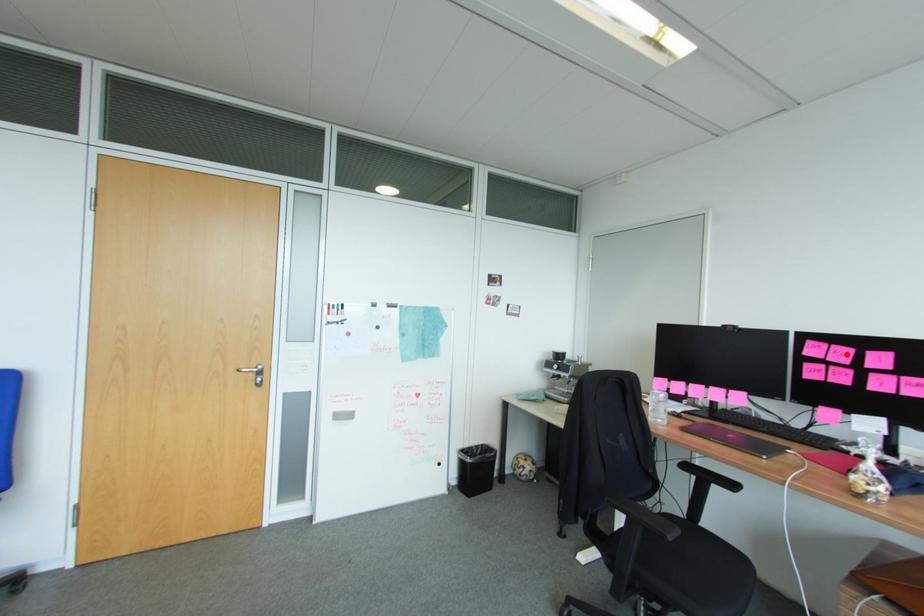
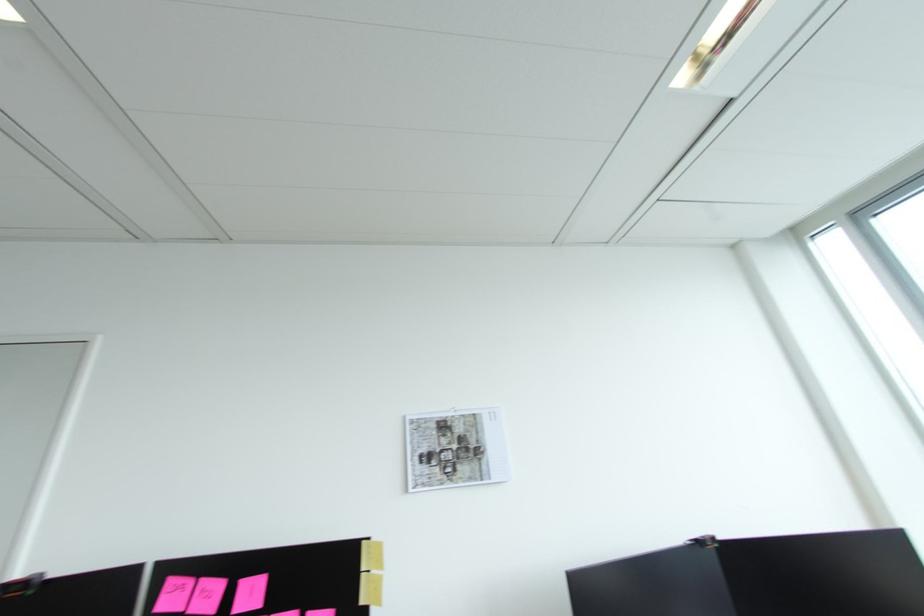
The point at the highlighted location is marked in the first image. Where is the corresponding point in the second image?

(213, 594)